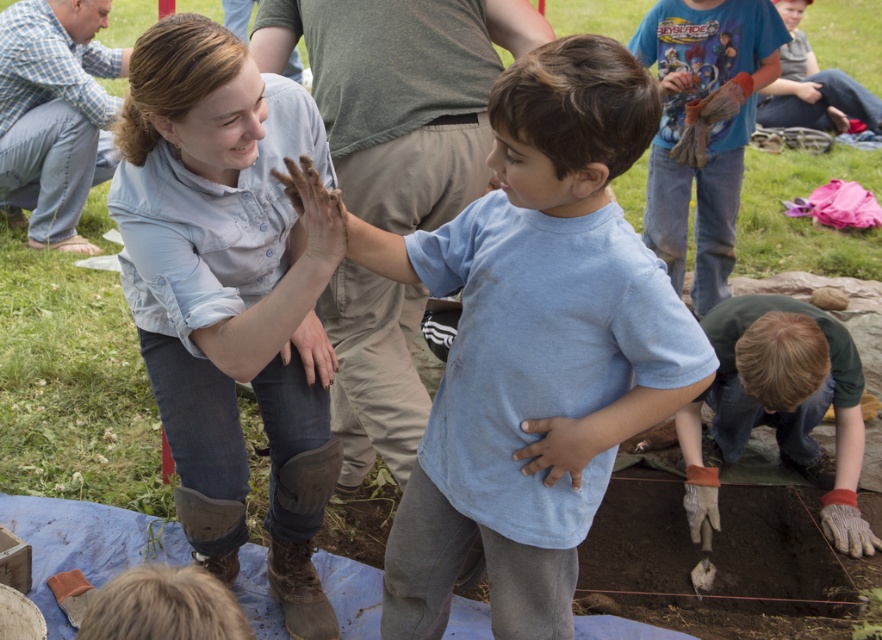
You are looking at the image of the archaeological dig scene. You see the denim jeans at center and the blue cotton shirt at upper right. Which object is positioned to the left of the other?

The denim jeans at center is to the left of the blue cotton shirt at upper right.

You are standing in the archaeological dig site and see two people wearing shirts. The first person is wearing a light blue cotton shirt at center and the second is wearing a green cotton shirt at lower right. Which shirt is positioned more to the left side of the image?

The light blue cotton shirt at center is positioned more to the left side of the image compared to the green cotton shirt at lower right.